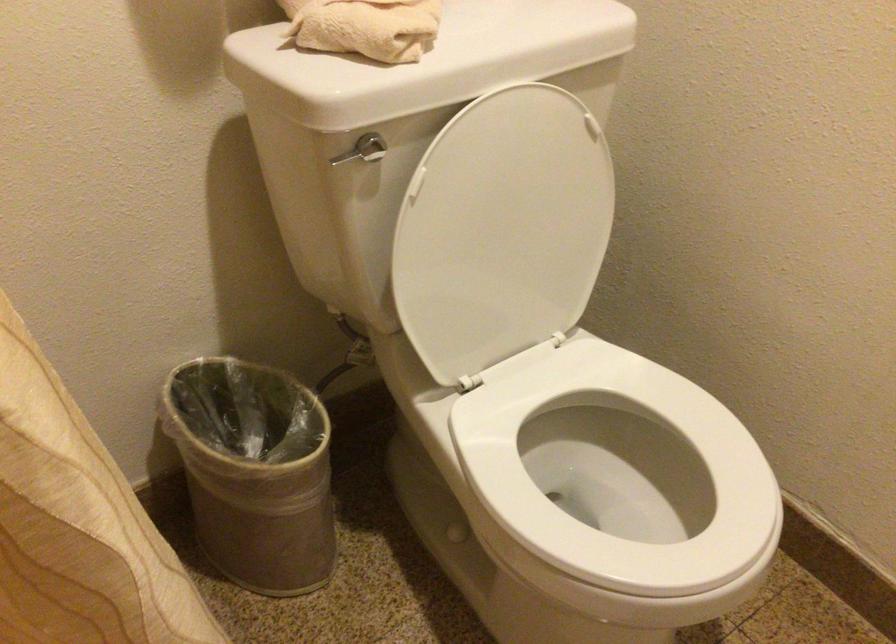
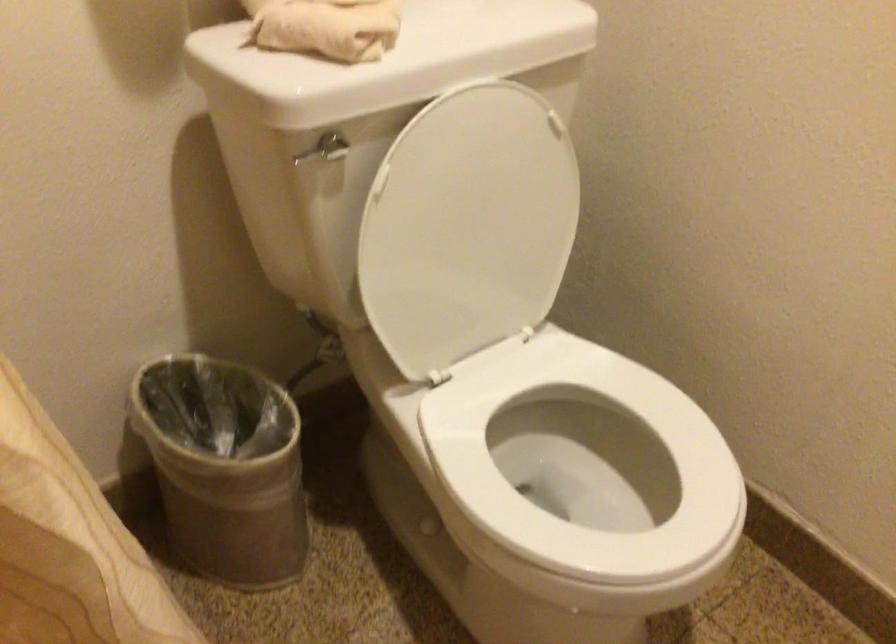
Question: The first image is from the beginning of the video and the second image is from the end. How did the camera likely rotate when shooting the video?

Choices:
 (A) Left
 (B) Right
 (C) Up
 (D) Down

Answer: (B)